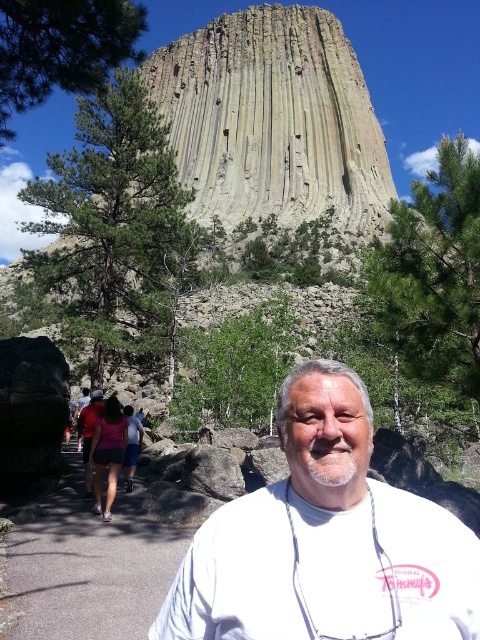
Question: Based on their relative distances, which object is farther from the green textured pine tree at left?

Choices:
 (A) white matte t-shirt at center
 (B) gray asphalt path at center

Answer: (A)

Question: Can you confirm if white matte t-shirt at center is positioned to the left of green textured pine at upper center?

Choices:
 (A) yes
 (B) no

Answer: (A)

Question: Which is farther from the green textured pine tree at left?

Choices:
 (A) green textured pine at upper center
 (B) white matte t-shirt at center

Answer: (B)

Question: Can you confirm if white matte t-shirt at center is positioned to the left of green textured pine tree at left?

Choices:
 (A) no
 (B) yes

Answer: (A)

Question: Is green textured pine tree at left to the left of gray asphalt path at center from the viewer's perspective?

Choices:
 (A) no
 (B) yes

Answer: (B)

Question: Which point appears closest to the camera in this image?

Choices:
 (A) (180, 248)
 (B) (51, 577)

Answer: (B)